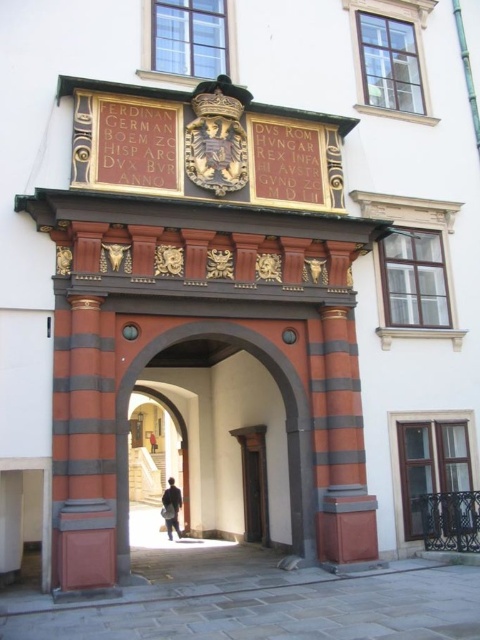
From the picture: You are a visitor approaching the historical gateway. You see a smooth wood door at center and a dark blue jacket at center. Which object is closer to you as you approach the gateway?

The smooth wood door at center is closer to you because it is in front of the dark blue jacket at center.

You are a painter standing in front of the historical gateway. You want to paint the smooth wood door at center and the dark blue jacket at center. Which object should you focus on first if you want to paint the wider one first?

The smooth wood door at center might be wider than dark blue jacket at center, so you should focus on painting the smooth wood door at center first.

You are a security guard at the castle entrance. You need to determine which object is narrower between the matte wood door at center and the dark brown leather jacket at center. Which one is it?

The matte wood door at center is thinner than the dark brown leather jacket at center, so the matte wood door at center is narrower.